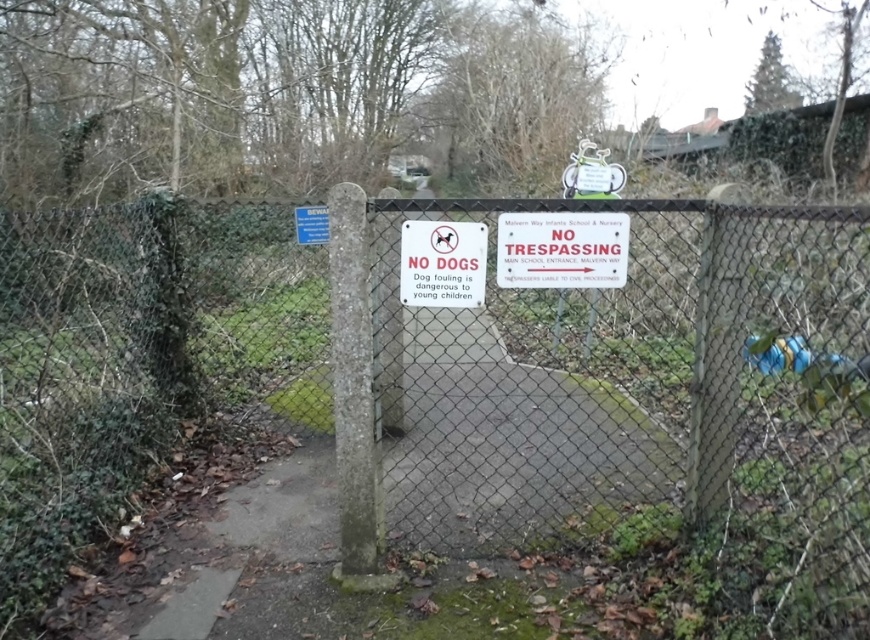
You are a parent trying to locate the main school entrance. You see the concrete at center and the white plastic sign at center. Which object is closer to you as you stand at the pathway entrance?

The concrete at center is closer to the viewer than the white plastic sign at center, so the concrete at center is closer to you.

You are a parent trying to find the main school entrance at Malvern Way Infants School. You see the concrete at center and the red plastic sign at center. How far apart are these two objects?

The concrete at center is 4.09 feet away from the red plastic sign at center.

You are a delivery person with a 1.5m wide delivery truck. You need to drive through the pathway shown in the image. The pathway is paved and has a concrete at center and a red plastic sign at center. Can your truck fit through the pathway?

The concrete at center is bigger than the red plastic sign at center, but the description does not provide specific measurements of the pathway width. Without knowing the actual width of the pathway, it is impossible to determine if the 1.5m wide truck can fit through.